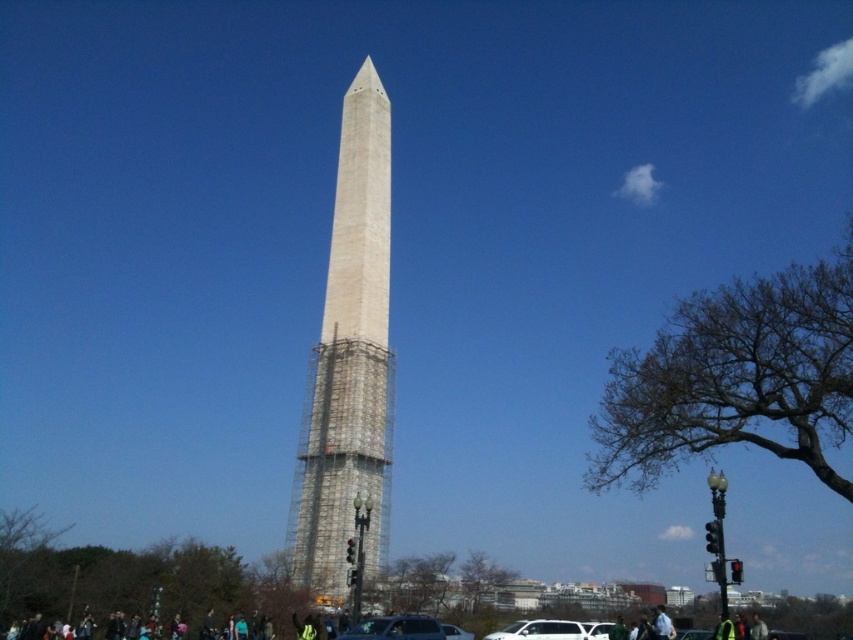
Who is taller, white matte car at center or silver metallic car at center?

With more height is white matte car at center.

Can you confirm if white matte car at center is shorter than silver metallic car at center?

Incorrect, white matte car at center's height does not fall short of silver metallic car at center's.

The height and width of the screenshot is (640, 853). Describe the element at coordinates (550, 628) in the screenshot. I see `white matte car at center` at that location.

At what (x,y) coordinates should I click in order to perform the action: click on white matte car at center. Please return your answer as a coordinate pair (x, y). Looking at the image, I should click on (550, 628).

Is point (350, 525) less distant than point (467, 634)?

Yes, it is.

Who is taller, white marble tower at center or silver metallic car at center?

Standing taller between the two is white marble tower at center.

Describe the element at coordinates (347, 362) in the screenshot. The height and width of the screenshot is (640, 853). I see `white marble tower at center` at that location.

I want to click on white marble tower at center, so click(x=347, y=362).

Is point (375, 180) behind point (370, 627)?

Yes, it is behind point (370, 627).

Between point (320, 572) and point (367, 618), which one is positioned in front?

Point (320, 572)

At what (x,y) coordinates should I click in order to perform the action: click on white marble tower at center. Please return your answer as a coordinate pair (x, y). Looking at the image, I should click on (347, 362).